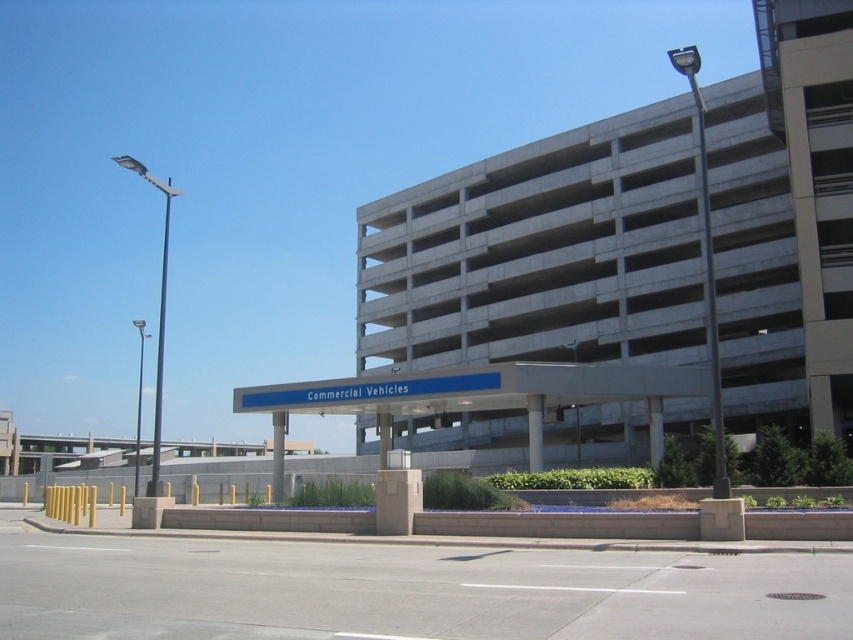
Is gray concrete parking garage at upper center to the left of metallic blue sign at upper center from the viewer's perspective?

In fact, gray concrete parking garage at upper center is to the right of metallic blue sign at upper center.

In the scene shown: Is gray concrete parking garage at upper center bigger than metallic blue sign at upper center?

Actually, gray concrete parking garage at upper center might be smaller than metallic blue sign at upper center.

What do you see at coordinates (543, 253) in the screenshot?
I see `gray concrete parking garage at upper center` at bounding box center [543, 253].

At what (x,y) coordinates should I click in order to perform the action: click on gray concrete parking garage at upper center. Please return your answer as a coordinate pair (x, y). This screenshot has width=853, height=640. Looking at the image, I should click on (543, 253).